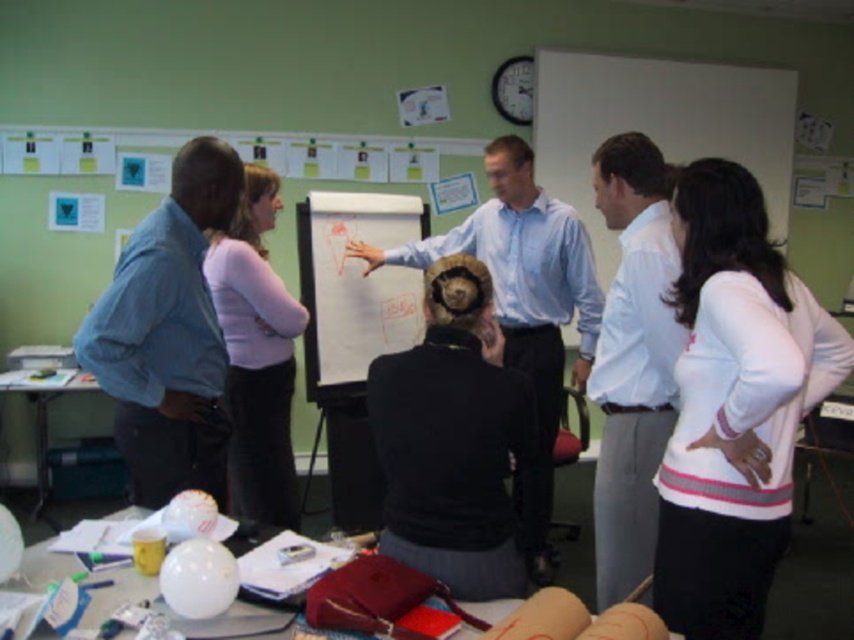
You are a photographer trying to capture a group photo of the blue striped shirt at left and the light purple sweater at center. To ensure both are in focus, you need to know their heights. Which person is shorter?

The blue striped shirt at left is shorter than the light purple sweater at center.

You are sitting at the table in the scene and want to hand a document to the person wearing the blue striped shirt at left. Since you are facing the whiteboard at center, which direction should you turn to reach them?

The blue striped shirt at left is to the left of the whiteboard at center, so if you are facing the whiteboard at center, you should turn to your left to reach the blue striped shirt at left.